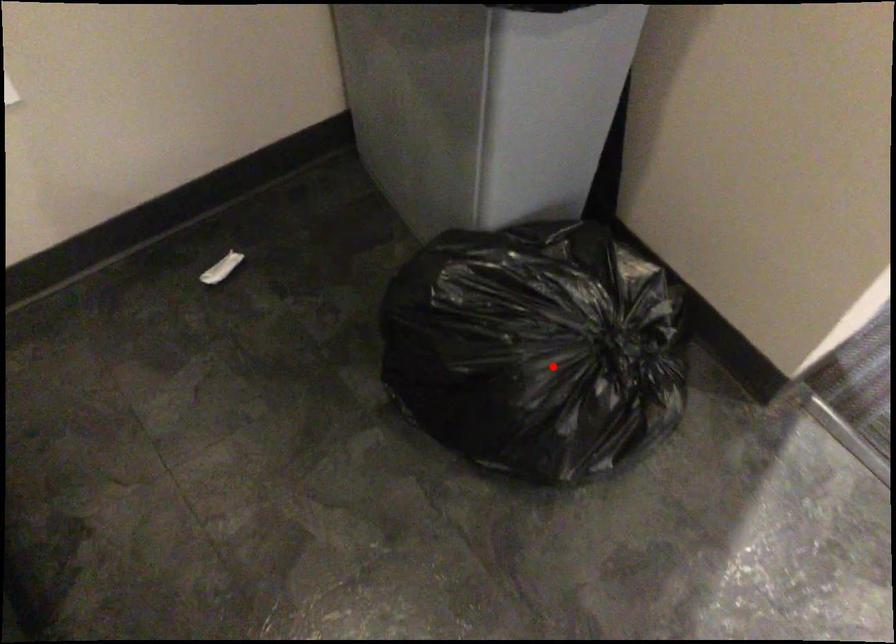
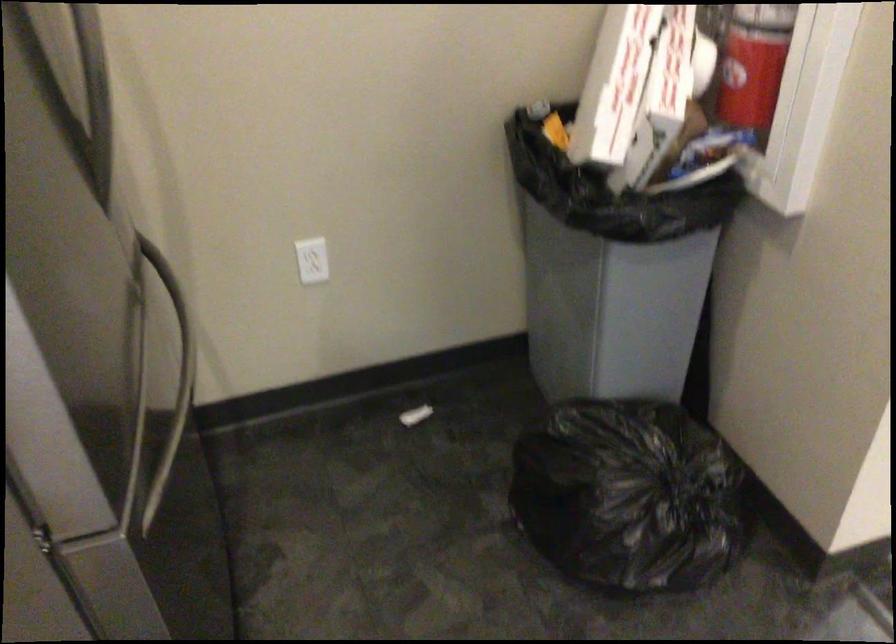
Question: I am providing you with two images of the same scene from different viewpoints. In image1, a red point is highlighted. Considering the same 3D point in image2, which of the following is correct?

Choices:
 (A) It is closer
 (B) It is farther

Answer: (B)